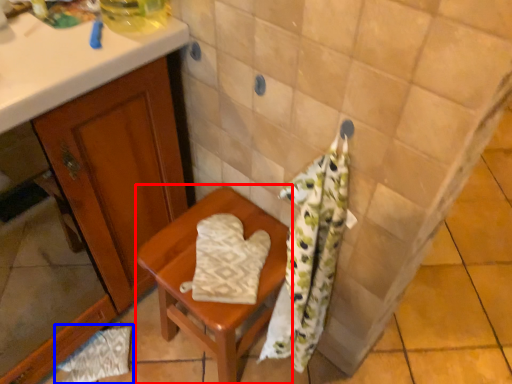
Question: Among these objects, which one is farthest to the camera, furniture (highlighted by a red box) or material (highlighted by a blue box)?

Choices:
 (A) furniture
 (B) material

Answer: (B)